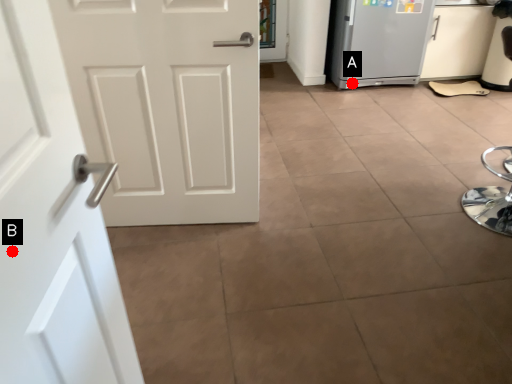
Question: Two points are circled on the image, labeled by A and B beside each circle. Which point is further to the camera?

Choices:
 (A) A is further
 (B) B is further

Answer: (A)